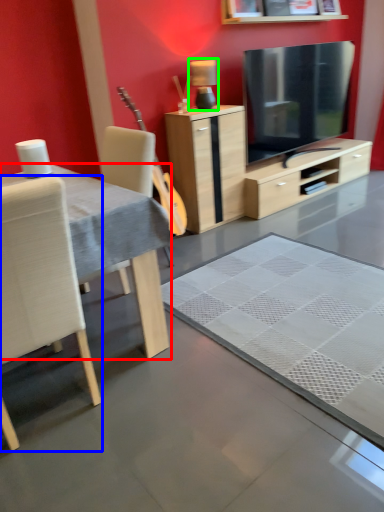
Question: Estimate the real-world distances between objects in this image. Which object is closer to desk (highlighted by a red box), chair (highlighted by a blue box) or lamp (highlighted by a green box)?

Choices:
 (A) chair
 (B) lamp

Answer: (A)